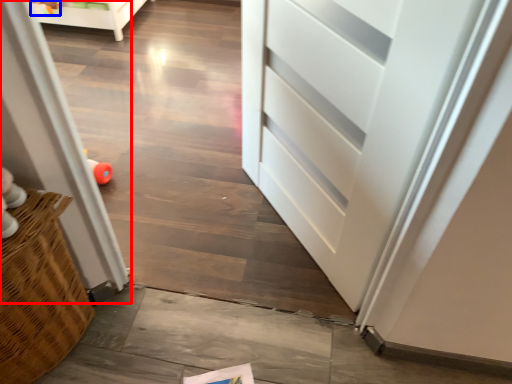
Question: Among these objects, which one is farthest to the camera, screen door (highlighted by a red box) or toy (highlighted by a blue box)?

Choices:
 (A) screen door
 (B) toy

Answer: (B)